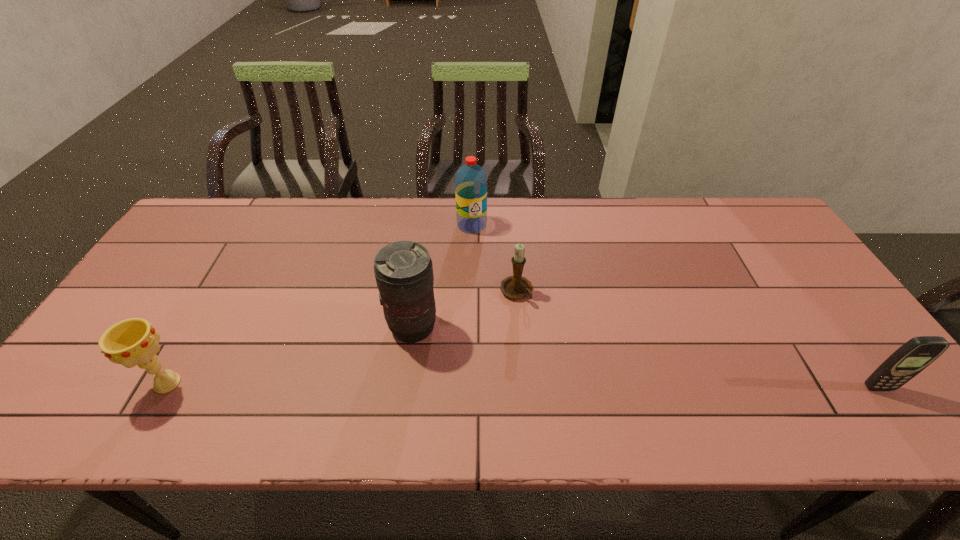
Find the location of a particular element. The height and width of the screenshot is (540, 960). vacant space on the desktop that is between the leftmost object and the cellular telephone and is positioned on the front label of the farthest object is located at coordinates (492, 386).

In order to click on free space on the desktop that is between the leftmost object and the rightmost object and is positioned on the side of the third farthest object where the control switches are located in this screenshot , I will do `click(480, 385)`.

Locate an element on the screen. The width and height of the screenshot is (960, 540). vacant spot on the desktop that is between the leftmost object and the rightmost object and is positioned on the side of the fourth object from left to right with the handle is located at coordinates (574, 386).